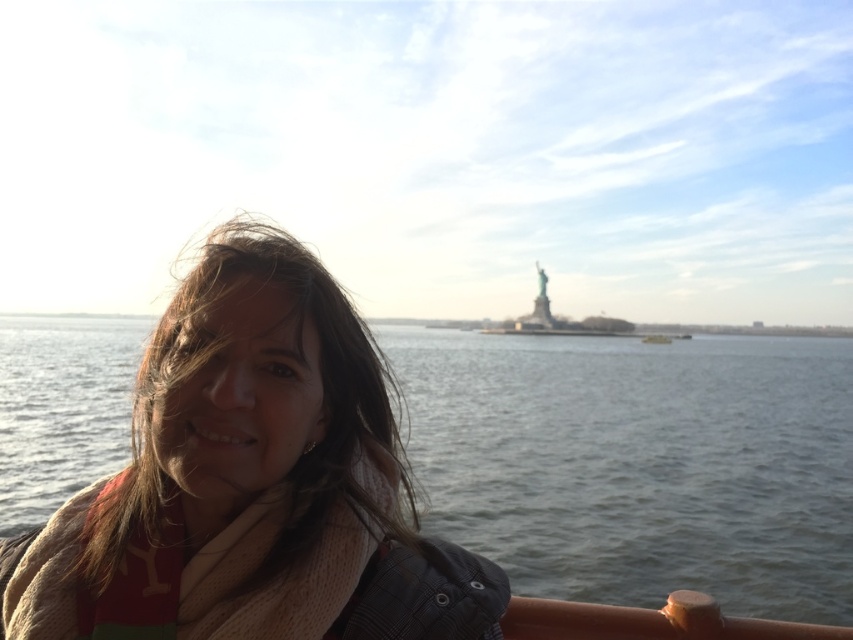
Does clear water at lower left have a lesser height compared to knitted beige scarf at center?

In fact, clear water at lower left may be taller than knitted beige scarf at center.

Does clear water at lower left have a greater height compared to knitted beige scarf at center?

Indeed, clear water at lower left has a greater height compared to knitted beige scarf at center.

Is point (811, 442) closer to viewer compared to point (254, 284)?

No, (811, 442) is further to viewer.

Locate an element on the screen. Image resolution: width=853 pixels, height=640 pixels. clear water at lower left is located at coordinates (640, 464).